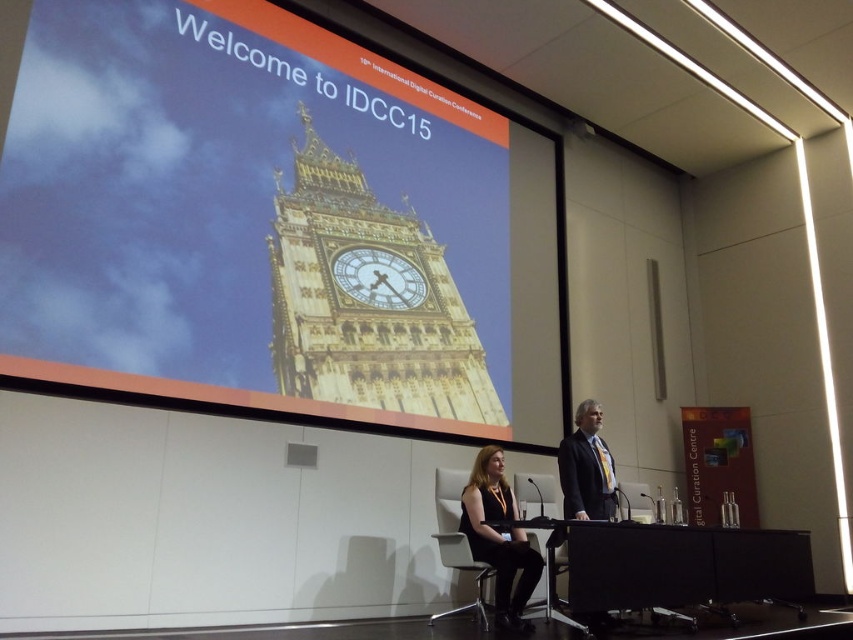
Question: Which object is the farthest from the black fabric dress at center?

Choices:
 (A) gold metallic clock tower at upper center
 (B) dark suit at right
 (C) gold/yellow stone big ben at center

Answer: (A)

Question: Which object is the farthest from the gold metallic clock tower at upper center?

Choices:
 (A) gold/yellow stone big ben at center
 (B) black fabric dress at center
 (C) dark suit at right

Answer: (C)

Question: Estimate the real-world distances between objects in this image. Which object is closer to the gold/yellow stone big ben at center?

Choices:
 (A) gold metallic clock tower at upper center
 (B) dark suit at right
 (C) black fabric dress at center

Answer: (A)

Question: Can you confirm if black fabric dress at center is smaller than dark suit at right?

Choices:
 (A) no
 (B) yes

Answer: (A)

Question: Where is gold metallic clock tower at upper center located in relation to black fabric dress at center in the image?

Choices:
 (A) right
 (B) left

Answer: (B)

Question: Does gold metallic clock tower at upper center have a smaller size compared to gold/yellow stone big ben at center?

Choices:
 (A) yes
 (B) no

Answer: (B)